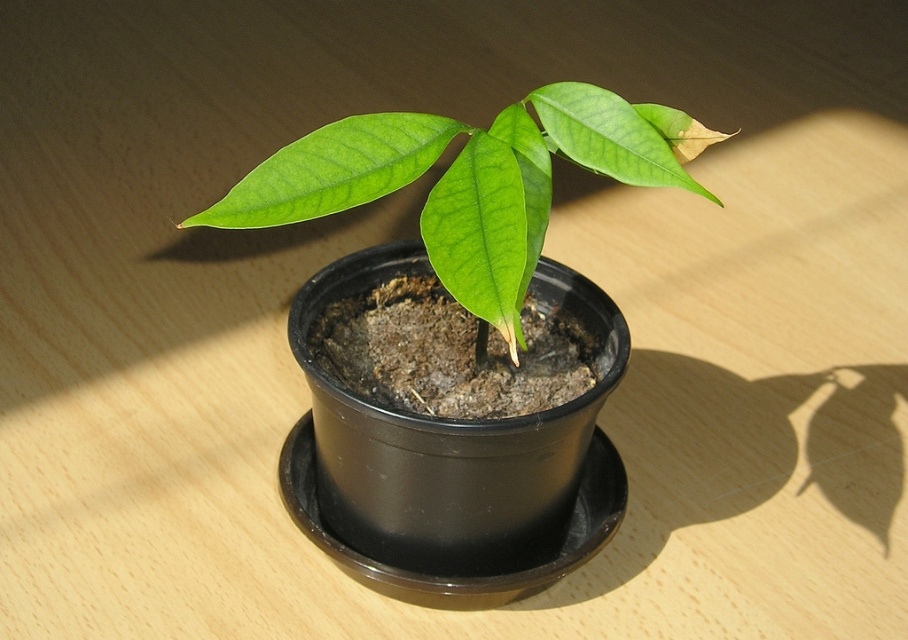
Question: Which object is closer to the camera taking this photo?

Choices:
 (A) green matte leaf at upper center
 (B) green glossy leaf at center

Answer: (B)

Question: Which is farther from the green matte leaf at center?

Choices:
 (A) green matte leaf at upper center
 (B) green glossy leaf at center

Answer: (A)

Question: Is green glossy leaf at center bigger than green matte leaf at upper center?

Choices:
 (A) no
 (B) yes

Answer: (A)

Question: Observing the image, what is the correct spatial positioning of green matte leaf at center in reference to green matte leaf at upper center?

Choices:
 (A) below
 (B) above

Answer: (A)

Question: Is green glossy leaf at center behind green matte leaf at upper center?

Choices:
 (A) no
 (B) yes

Answer: (A)

Question: Which of these objects is positioned closest to the green matte leaf at center?

Choices:
 (A) green glossy leaf at center
 (B) green matte leaf at upper center

Answer: (A)